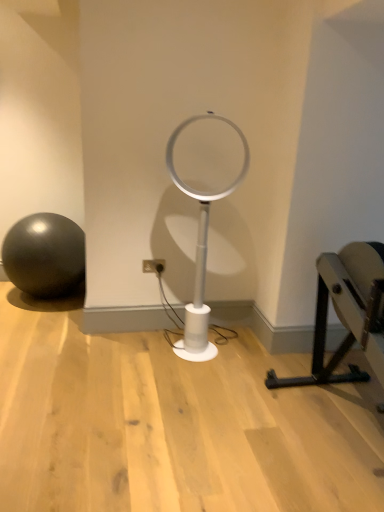
The height and width of the screenshot is (512, 384). I want to click on free location to the right of white plastic table lamp at center, so click(x=256, y=355).